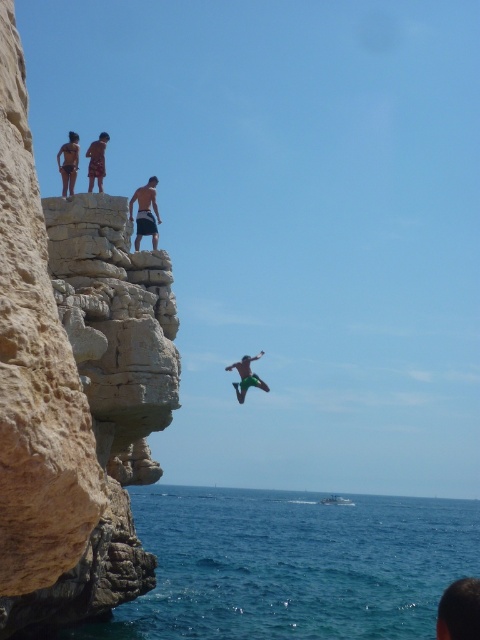
What do you see at coordinates (145, 212) in the screenshot?
I see `dark blue shorts at upper center` at bounding box center [145, 212].

Which of these two, dark blue shorts at upper center or dark brown shorts at upper center, stands shorter?

Standing shorter between the two is dark blue shorts at upper center.

Does point (144, 211) come farther from viewer compared to point (101, 156)?

Yes, it is behind point (101, 156).

You are a GUI agent. You are given a task and a screenshot of the screen. Output one action in this format:
    pyautogui.click(x=<x>, y=<y>)
    Task: Click on the dark blue shorts at upper center
    
    Given the screenshot: What is the action you would take?
    pyautogui.click(x=145, y=212)

Which of these two, dark blue shorts at upper center or matte black shorts at upper left, stands taller?

matte black shorts at upper left

Can you confirm if dark blue shorts at upper center is bigger than matte black shorts at upper left?

Actually, dark blue shorts at upper center might be smaller than matte black shorts at upper left.

Measure the distance between dark blue shorts at upper center and camera.

A distance of 244.51 feet exists between dark blue shorts at upper center and camera.

You are a GUI agent. You are given a task and a screenshot of the screen. Output one action in this format:
    pyautogui.click(x=<x>, y=<y>)
    Task: Click on the dark blue shorts at upper center
    This screenshot has width=480, height=640.
    Given the screenshot: What is the action you would take?
    pyautogui.click(x=145, y=212)

From the picture: Measure the distance between point (381, 561) and camera.

The distance of point (381, 561) from camera is 149.34 meters.

This screenshot has height=640, width=480. What do you see at coordinates (291, 564) in the screenshot? I see `blue liquid water at lower center` at bounding box center [291, 564].

At what (x,y) coordinates should I click in order to perform the action: click on blue liquid water at lower center. Please return your answer as a coordinate pair (x, y). This screenshot has width=480, height=640. Looking at the image, I should click on (291, 564).